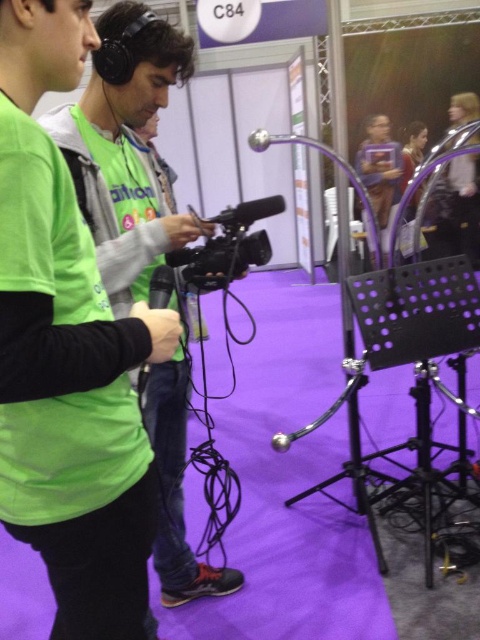
Question: Is green matte shirt at center positioned at the back of black plastic video camera at center?

Choices:
 (A) yes
 (B) no

Answer: (B)

Question: Does green matte shirt at center appear on the right side of black plastic video camera at center?

Choices:
 (A) yes
 (B) no

Answer: (B)

Question: Does green matte shirt at center appear under black plastic video camera at center?

Choices:
 (A) yes
 (B) no

Answer: (A)